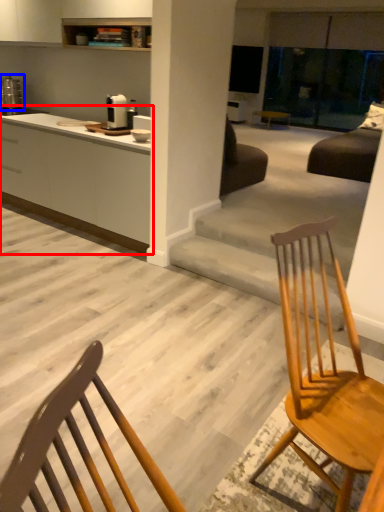
Question: Among these objects, which one is farthest to the camera, cabinetry (highlighted by a red box) or appliance (highlighted by a blue box)?

Choices:
 (A) cabinetry
 (B) appliance

Answer: (B)